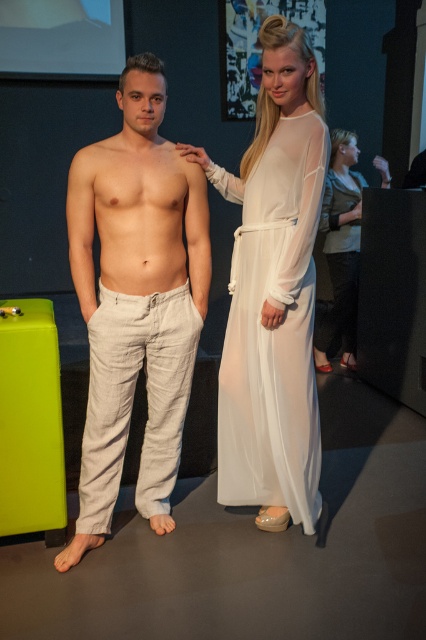
You are at an event and need to find the light beige linen pants at left and the white sheer dress at center. Based on their positions, which clothing item is closer to the entrance of the room?

The light beige linen pants at left is to the left of the white sheer dress at center, so the light beige linen pants at left is closer to the entrance if the entrance is on the left side of the room.

Based on the scene description, where is the white sheer dress at center located in relation to the beige linen pants at center?

The white sheer dress at center is located to the right of the beige linen pants at center.

You are an event planner organizing a photoshoot and need to decide which garment to feature first based on their visual impact. Given the white sheer dress at center and beige linen pants at center, which one is more likely to draw attention due to its width?

The white sheer dress at center is thinner than beige linen pants at center, so the beige linen pants at center would draw more attention due to its wider appearance.